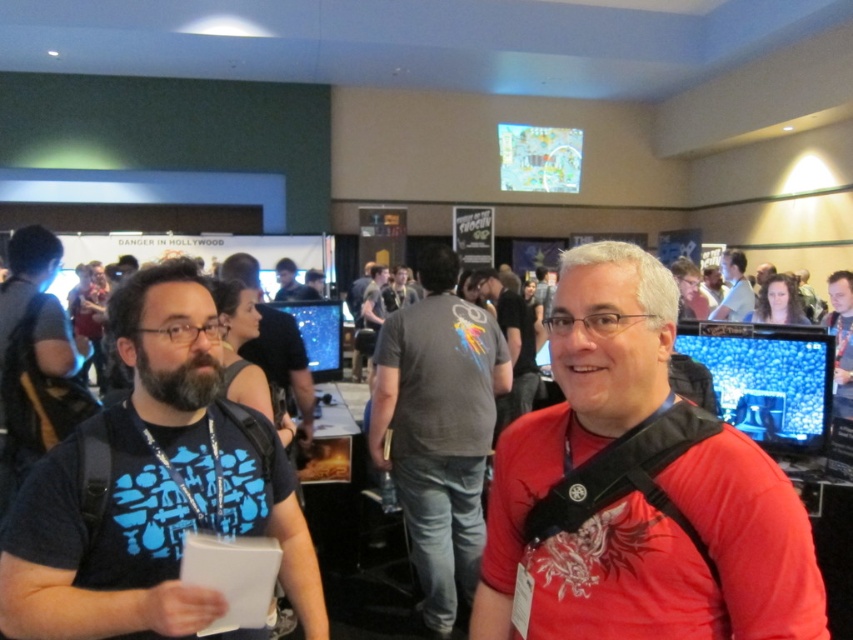
Is red matte shirt at center taller than matte black shirt at center?

Correct, red matte shirt at center is much taller as matte black shirt at center.

Who is shorter, red matte shirt at center or matte black shirt at center?

matte black shirt at center

Image resolution: width=853 pixels, height=640 pixels. Describe the element at coordinates (637, 492) in the screenshot. I see `red matte shirt at center` at that location.

The image size is (853, 640). What are the coordinates of `red matte shirt at center` in the screenshot? It's located at (637, 492).

Looking at this image, is blue printed t-shirt at center taller than matte black shirt at center?

Indeed, blue printed t-shirt at center has a greater height compared to matte black shirt at center.

Is point (281, 484) positioned in front of point (289, 276)?

Yes.

Identify the location of blue printed t-shirt at center. (152, 490).

Who is shorter, gray cotton t-shirt at center or matte black shirt at center?

Standing shorter between the two is matte black shirt at center.

Which is in front, point (428, 579) or point (297, 289)?

Positioned in front is point (428, 579).

I want to click on gray cotton t-shirt at center, so click(x=438, y=428).